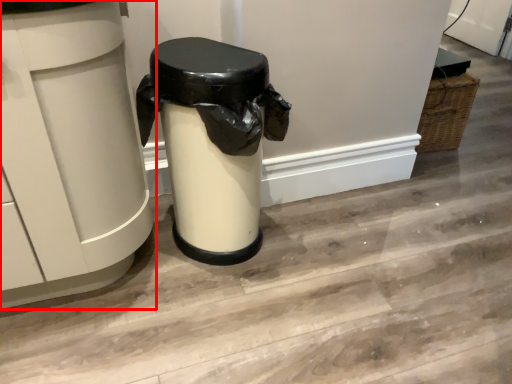
Question: Considering the relative positions of waste container (annotated by the red box) and waste container in the image provided, where is waste container (annotated by the red box) located with respect to the staircase?

Choices:
 (A) left
 (B) right

Answer: (A)